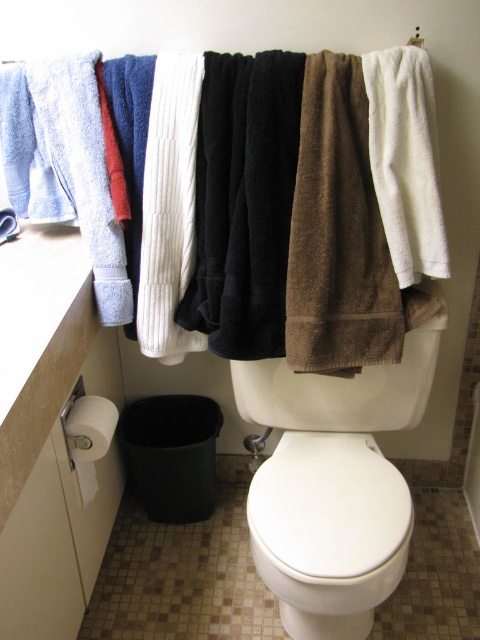
Question: Is white glossy toilet lid at center below white fluffy towel at upper right?

Choices:
 (A) no
 (B) yes

Answer: (B)

Question: Which object is the farthest from the white glossy toilet bowl at center?

Choices:
 (A) white fluffy towel at upper right
 (B) white matte toilet paper at lower left
 (C) white glossy toilet lid at center
 (D) terry cloth towels at upper center

Answer: (B)

Question: Which point is closer to the camera?

Choices:
 (A) white glossy toilet lid at center
 (B) white matte toilet paper at lower left

Answer: (A)

Question: Considering the real-world distances, which object is farthest from the terry cloth towels at upper center?

Choices:
 (A) white matte toilet paper at lower left
 (B) white glossy toilet lid at center
 (C) brown cotton towel at center
 (D) white glossy toilet bowl at center

Answer: (A)

Question: Is terry cloth towels at upper center behind white fluffy towel at upper right?

Choices:
 (A) yes
 (B) no

Answer: (A)

Question: Does white glossy toilet bowl at center appear over brown cotton towel at center?

Choices:
 (A) yes
 (B) no

Answer: (B)